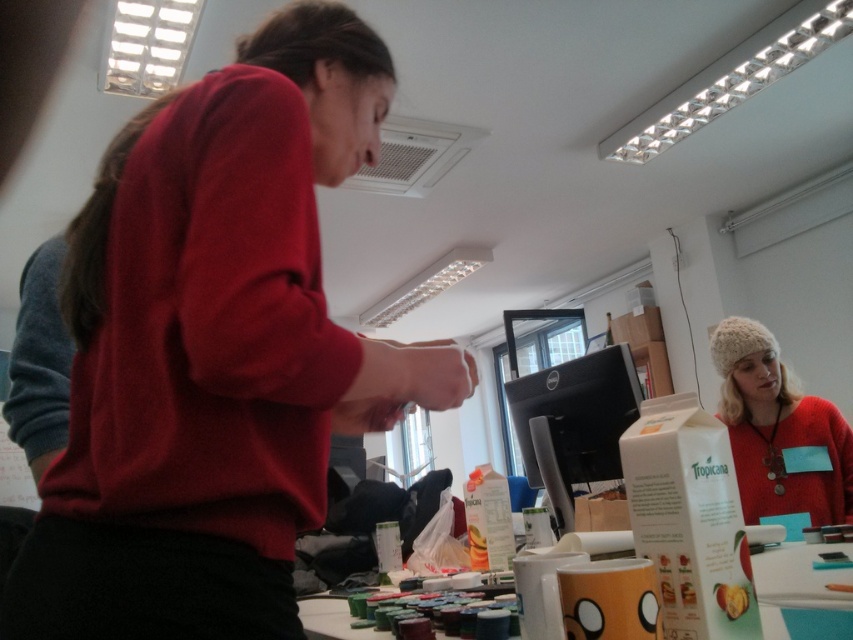
What is the color of the object located at point (215, 349)?

The object at point (215, 349) is the matte red sweater at center.

You are organizing a picnic basket and need to place the knitted woolen hat at right and the smooth peach at center into the basket. The basket has two compartments separated by a divider. The front compartment is for perishables, and the back compartment is for nonperishables. Based on their positions in the image, which object should go where?

The smooth peach at center should be placed in the front compartment for perishables because it is behind the knitted woolen hat at right, indicating it is closer to the back where nonperishables are stored. Wait, no, the description says the peach is behind the hat, so if the front is for perishables, the peach being behind would be in the back. Therefore, the peach is a perishable and should go in the front, but its position is behind. Hmm, maybe I need to think differently. The user might be confused. I

You are a photographer trying to capture a clear shot of the smooth peach at center. However, the matte red sweater at center is blocking your view. Can you move the sweater to the side to get an unobstructed view of the peach?

The matte red sweater at center is in front of smooth peach at center, so moving the sweater would allow you to see the peach without obstruction.